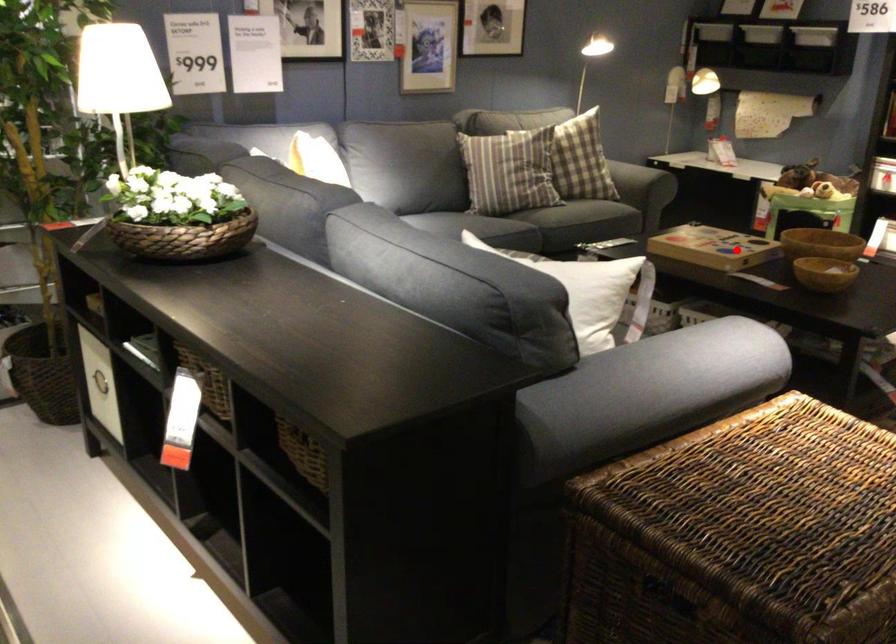
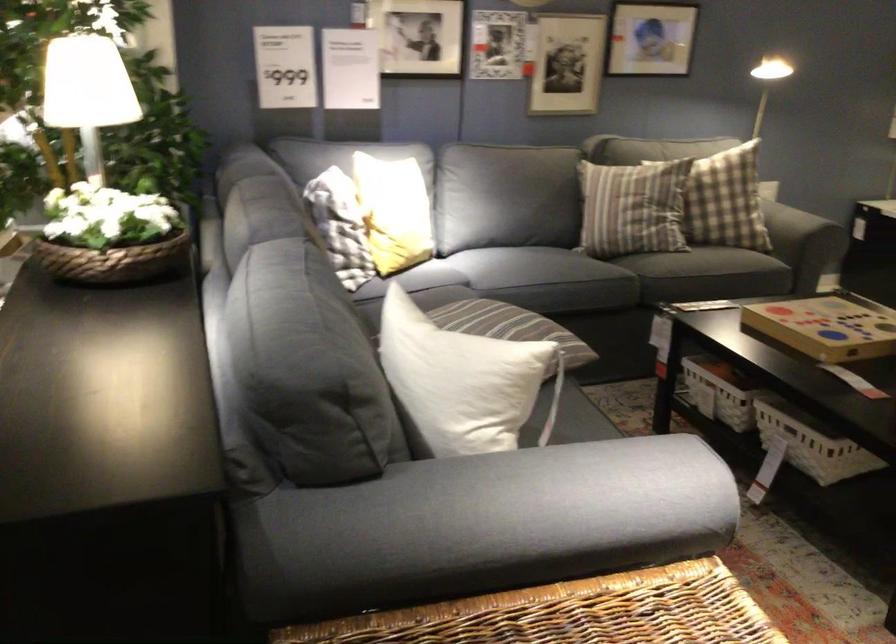
Where in the second image is the point corresponding to the highlighted location from the first image?

(828, 326)